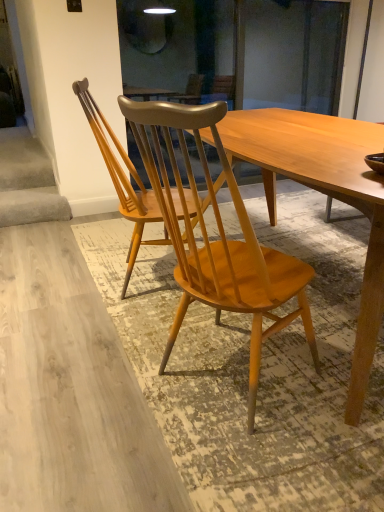
Question: Should I look upward or downward to see light brown wood chair at center, positioned as the 1th chair in back-to-front order?

Choices:
 (A) down
 (B) up

Answer: (B)

Question: Is light brown wood chair at center, arranged as the second chair when viewed from the front, bigger than natural wood chair at center, acting as the first chair starting from the front?

Choices:
 (A) no
 (B) yes

Answer: (B)

Question: Is light brown wood chair at center, arranged as the second chair when viewed from the front, directly adjacent to natural wood chair at center, arranged as the second chair when viewed from the back?

Choices:
 (A) yes
 (B) no

Answer: (B)

Question: Is light brown wood chair at center, arranged as the second chair when viewed from the front, facing away from natural wood chair at center, acting as the first chair starting from the front?

Choices:
 (A) no
 (B) yes

Answer: (A)

Question: Can you confirm if light brown wood chair at center, positioned as the 1th chair in back-to-front order, is wider than natural wood chair at center, acting as the first chair starting from the front?

Choices:
 (A) yes
 (B) no

Answer: (A)

Question: From a real-world perspective, is light brown wood chair at center, positioned as the 1th chair in back-to-front order, under natural wood chair at center, acting as the first chair starting from the front?

Choices:
 (A) yes
 (B) no

Answer: (B)

Question: Does light brown wood chair at center, arranged as the second chair when viewed from the front, have a lesser width compared to natural wood chair at center, acting as the first chair starting from the front?

Choices:
 (A) no
 (B) yes

Answer: (A)

Question: Is natural wood chair at center, arranged as the second chair when viewed from the back, further to the viewer compared to light brown wood chair at center, positioned as the 1th chair in back-to-front order?

Choices:
 (A) yes
 (B) no

Answer: (B)

Question: Does natural wood chair at center, acting as the first chair starting from the front, appear on the left side of light brown wood chair at center, positioned as the 1th chair in back-to-front order?

Choices:
 (A) no
 (B) yes

Answer: (A)

Question: Does natural wood chair at center, acting as the first chair starting from the front, have a lesser height compared to light brown wood chair at center, positioned as the 1th chair in back-to-front order?

Choices:
 (A) yes
 (B) no

Answer: (B)

Question: Considering the relative sizes of natural wood chair at center, acting as the first chair starting from the front, and light brown wood chair at center, positioned as the 1th chair in back-to-front order, in the image provided, is natural wood chair at center, acting as the first chair starting from the front, bigger than light brown wood chair at center, positioned as the 1th chair in back-to-front order,?

Choices:
 (A) yes
 (B) no

Answer: (B)

Question: Is natural wood chair at center, arranged as the second chair when viewed from the back, to the right of light brown wood chair at center, positioned as the 1th chair in back-to-front order, from the viewer's perspective?

Choices:
 (A) no
 (B) yes

Answer: (B)

Question: Is natural wood chair at center, arranged as the second chair when viewed from the back, closer to the viewer compared to light brown wood chair at center, positioned as the 1th chair in back-to-front order?

Choices:
 (A) yes
 (B) no

Answer: (A)

Question: From the image's perspective, is natural wood chair at center, arranged as the second chair when viewed from the back, located above or below light brown wood chair at center, positioned as the 1th chair in back-to-front order?

Choices:
 (A) above
 (B) below

Answer: (B)